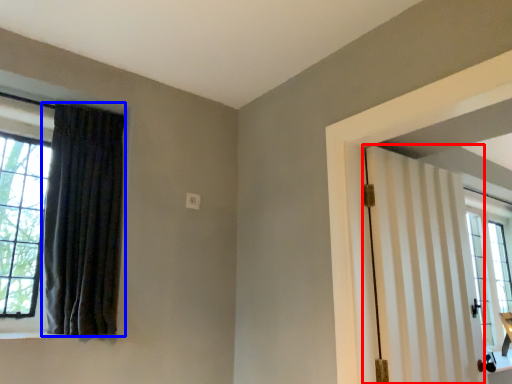
Question: Which object appears closest to the camera in this image, door (highlighted by a red box) or curtain (highlighted by a blue box)?

Choices:
 (A) door
 (B) curtain

Answer: (A)